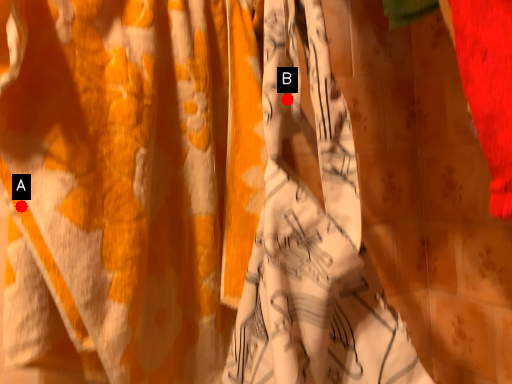
Question: Two points are circled on the image, labeled by A and B beside each circle. Which point is farther to the camera?

Choices:
 (A) A is further
 (B) B is further

Answer: (B)